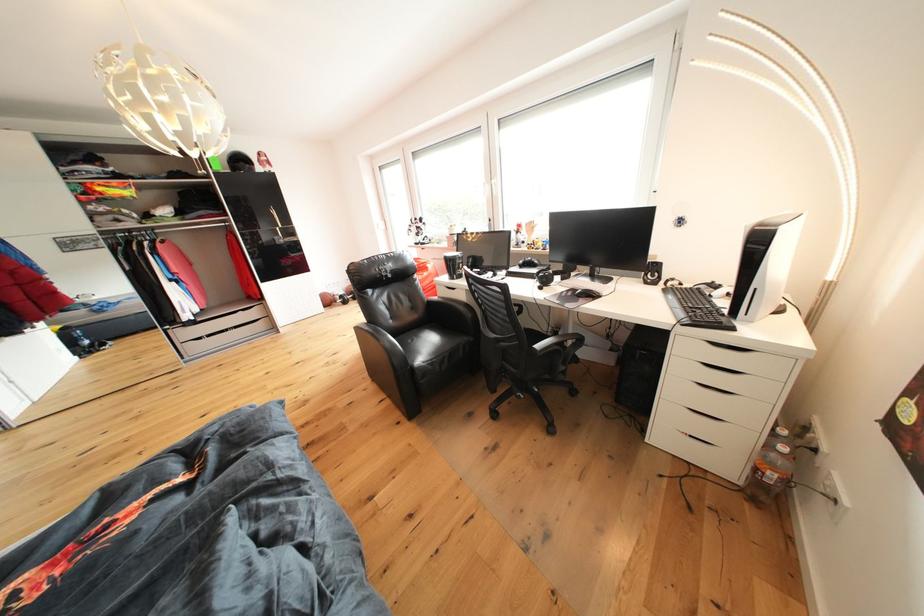
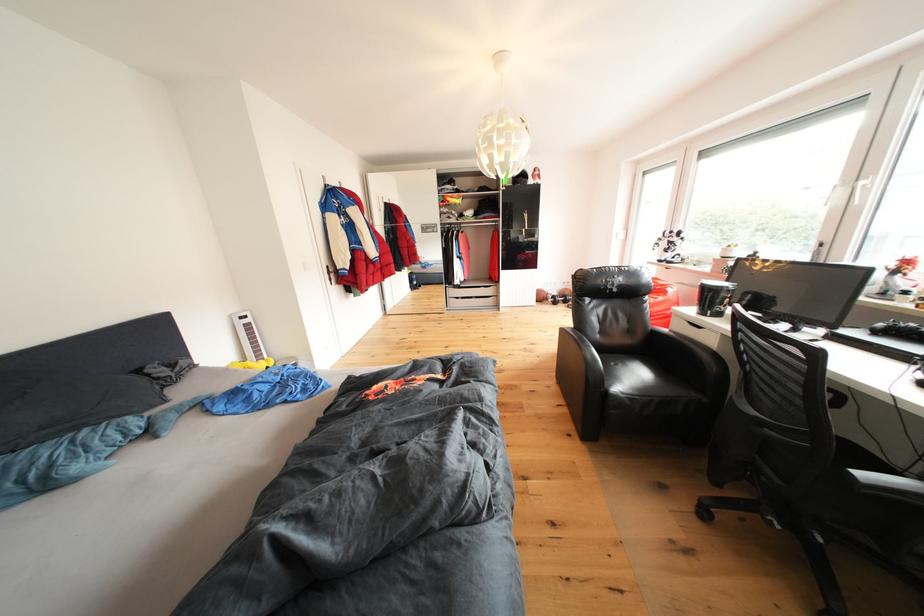
Find the pixel in the second image that matches point 349,302 in the first image.

(563, 302)